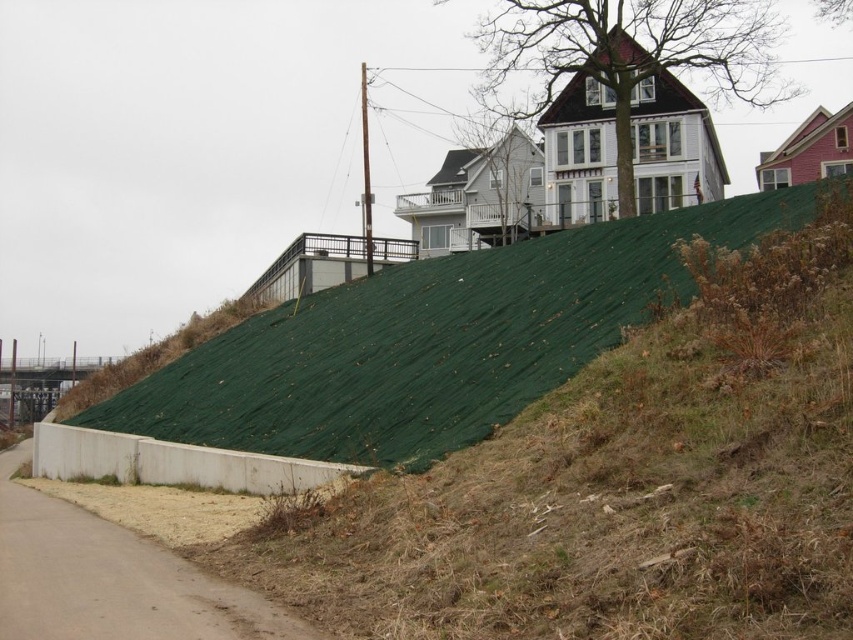
You are standing at the base of the hillside and looking up. Which object is positioned to the left when comparing the green fabric at upper center and the brown shingles at upper center?

The green fabric at upper center is positioned to the left of the brown shingles at upper center.

Based on the photo, you are standing at the base of the hillside looking up towards the slope covered with green erosion control fabric. There are two points marked on the slope. The first point is located at coordinates point (833, 316) and the second point is at point (676, 109). Which of these two points is closer to your current position?

Point (833, 316) is closer to the camera than point (676, 109), so the first point is closer to your current position.

You are a contractor assessing the slope stability of the hillside. You notice the green fabric at upper center and the brown shingles at upper center. Which object is positioned lower on the slope?

The green fabric at upper center is positioned lower on the slope because it has a lesser height compared to the brown shingles at upper center.